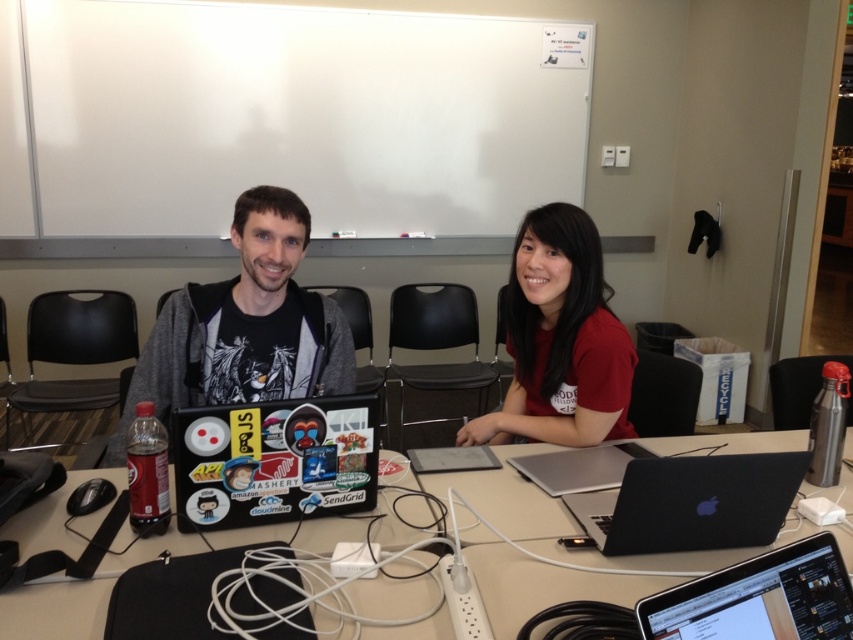
You are organizing a tech conference and need to set up two laptops for a presentation. The black matte laptop at center and the black plastic laptop at lower right are available. Which laptop should be placed closer to the audience to ensure visibility?

The black matte laptop at center should be placed closer to the audience since the black plastic laptop at lower right is positioned behind it, making it less visible from the front.

You are a graphic designer working on a project and need to place a new sticker on your black matte laptop at center. The sticker requires a 1 cm border around all edges. Given the laptop screen dimensions are 15 inches diagonally, can you determine if there is enough space on the screen to accommodate the sticker?

The black matte laptop at center has a screen size of 15 inches diagonally. Assuming standard aspect ratios, the sticker with a 1 cm border around all edges should fit as long as the sticker dimensions are within the screen area minus the border. However, without exact screen dimensions, precise calculation isn not possible. Consider measuring the screen first.